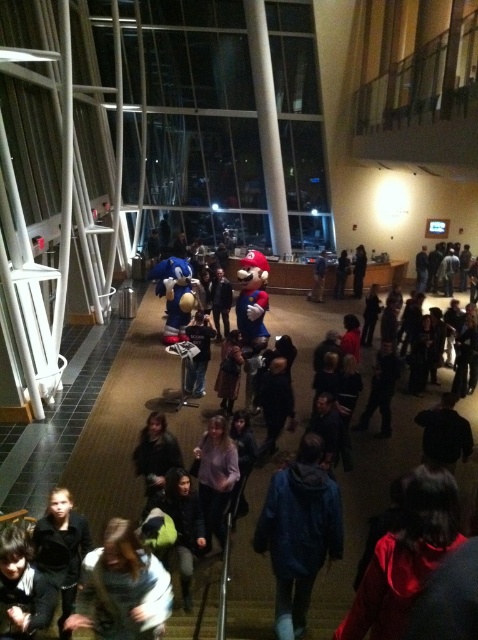
Question: Can you confirm if black leather jacket at lower left is positioned below blue denim jacket at center?

Choices:
 (A) no
 (B) yes

Answer: (B)

Question: Which object is positioned farthest from the dark blue hoodie at lower left?

Choices:
 (A) blue fuzzy jacket at lower center
 (B) dark blue hoodie at center

Answer: (B)

Question: Does dark red fabric at lower right appear on the left side of light purple fabric shirt at center?

Choices:
 (A) no
 (B) yes

Answer: (A)

Question: Estimate the real-world distances between objects in this image. Which object is closer to the blue denim jacket at center?

Choices:
 (A) dark blue hoodie at lower left
 (B) light purple fabric shirt at center

Answer: (B)

Question: Is black leather jacket at lower left further to the viewer compared to light purple fabric shirt at center?

Choices:
 (A) yes
 (B) no

Answer: (B)

Question: Based on their relative distances, which object is nearer to the dark blue hoodie at lower left?

Choices:
 (A) blue fuzzy jacket at lower center
 (B) blue denim jacket at center
 (C) light brown hair at center

Answer: (C)